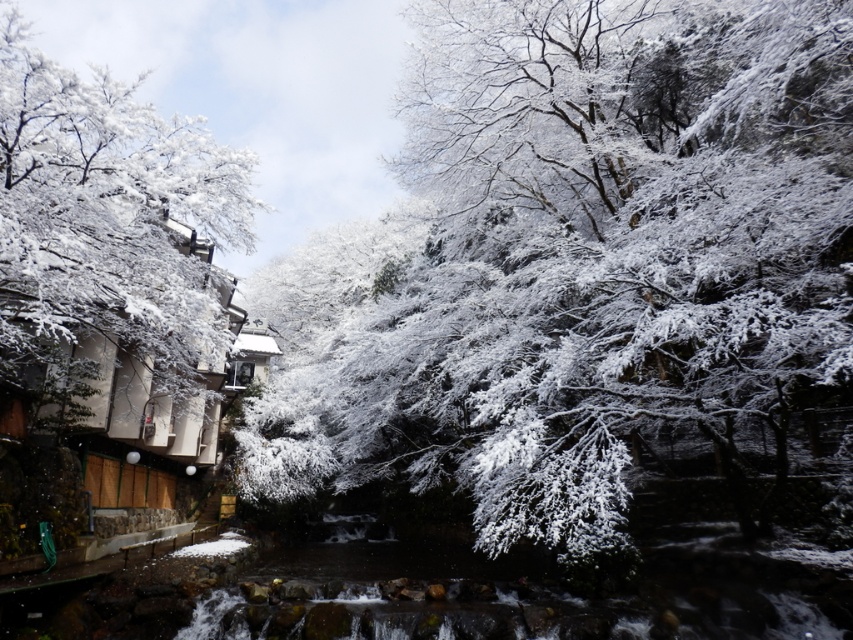
Does snow-covered branches at center have a greater width compared to white snow-covered tree at left?

Yes, snow-covered branches at center is wider than white snow-covered tree at left.

Between point (303, 428) and point (36, 192), which one is positioned behind?

The point (303, 428) is more distant.

What are the coordinates of `snow-covered branches at center` in the screenshot? It's located at (579, 266).